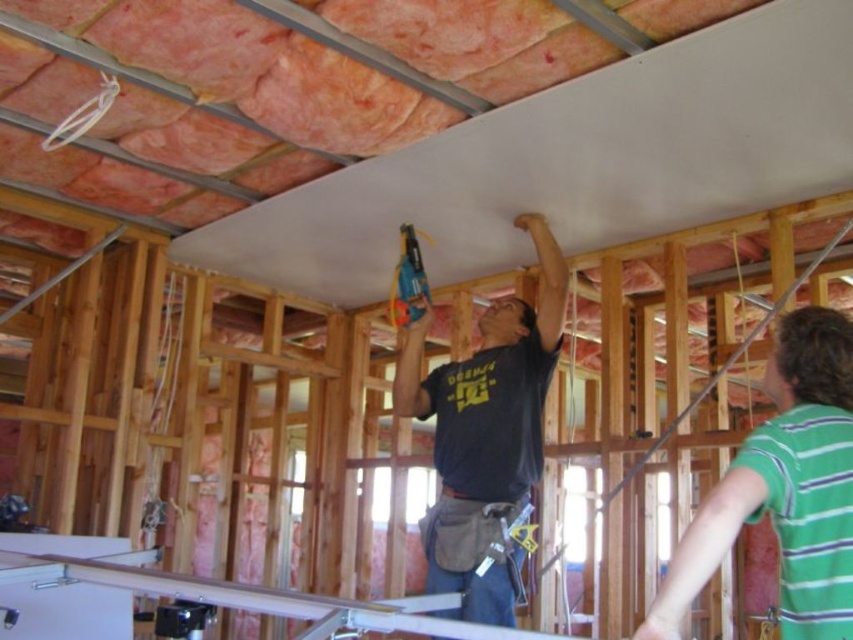
Question: Among these points, which one is nearest to the camera?

Choices:
 (A) (553, 288)
 (B) (405, 269)
 (C) (822, 538)

Answer: (C)

Question: Does green striped shirt at upper right come behind dark gray shirt at upper center?

Choices:
 (A) no
 (B) yes

Answer: (A)

Question: Does green striped shirt at upper right appear on the left side of dark gray shirt at upper center?

Choices:
 (A) yes
 (B) no

Answer: (B)

Question: Which point is farther from the camera taking this photo?

Choices:
 (A) (813, 394)
 (B) (535, 346)
 (C) (399, 257)

Answer: (C)

Question: Which point is farther from the camera taking this photo?

Choices:
 (A) (701, 508)
 (B) (532, 376)
 (C) (397, 268)

Answer: (C)

Question: Is green striped shirt at upper right to the right of blue plastic drill at center from the viewer's perspective?

Choices:
 (A) yes
 (B) no

Answer: (A)